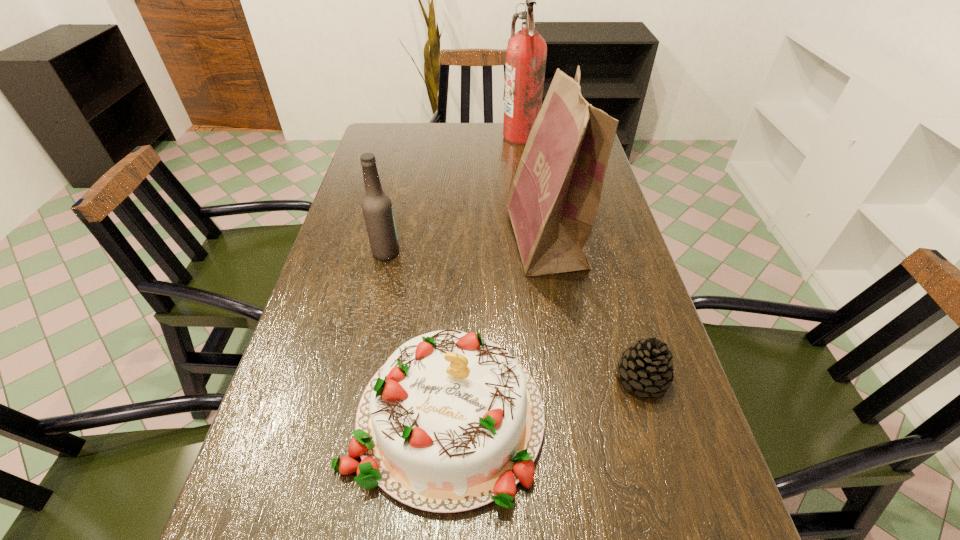
Point out which object is positioned as the third nearest to the third shortest object. Please provide its 2D coordinates. Your answer should be formatted as a tuple, i.e. [(x, y)], where the tuple contains the x and y coordinates of a point satisfying the conditions above.

[(646, 366)]